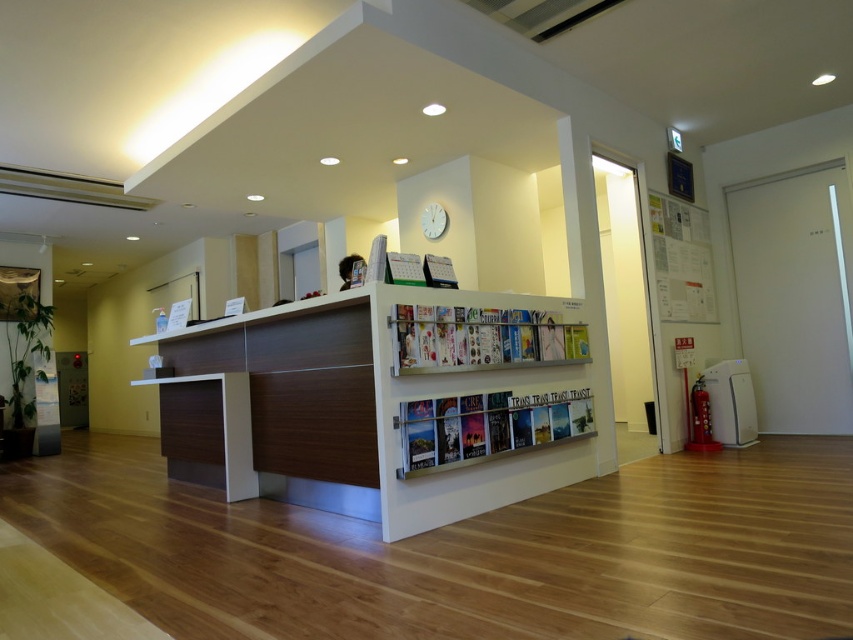
Question: Which point is closer to the camera taking this photo?

Choices:
 (A) (706, 237)
 (B) (247, 452)

Answer: (B)

Question: Can you confirm if matte white book at center is thinner than white paperboard at upper right?

Choices:
 (A) no
 (B) yes

Answer: (A)

Question: Which point is closer to the camera?

Choices:
 (A) (514, 360)
 (B) (434, 209)
 (C) (454, 424)

Answer: (C)

Question: Does white glossy magazine at center have a greater width compared to white paperboard at upper right?

Choices:
 (A) yes
 (B) no

Answer: (A)

Question: Among these points, which one is farthest from the camera?

Choices:
 (A) (541, 307)
 (B) (410, 460)

Answer: (A)

Question: Does white glossy magazine at center appear on the left side of white matte clock at upper center?

Choices:
 (A) yes
 (B) no

Answer: (B)